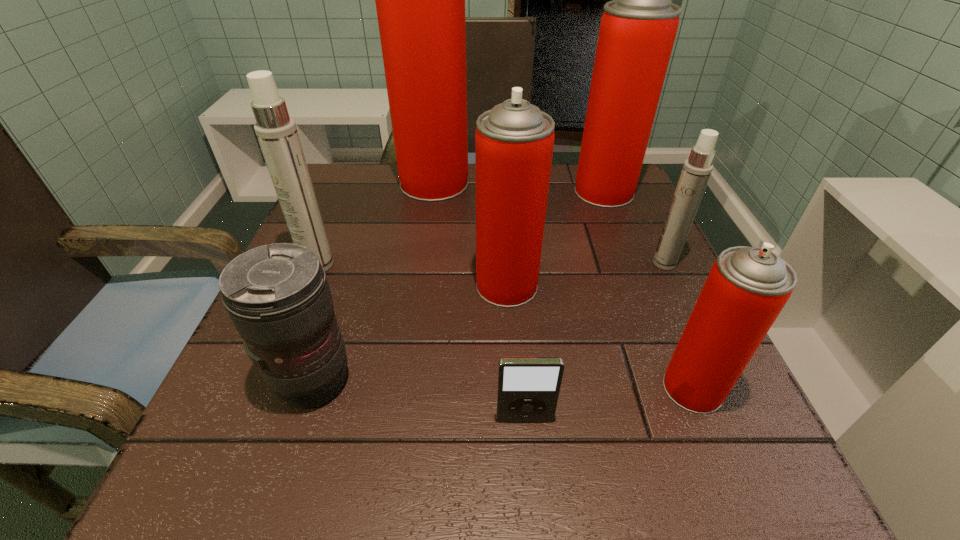
In the image, there is a desktop. Where is `free space at the far right corner`? The height and width of the screenshot is (540, 960). free space at the far right corner is located at coordinates (577, 175).

What are the coordinates of `vacant space in between the second nearest red aerosol can and the nearest red aerosol can` in the screenshot? It's located at (600, 337).

Where is `unoccupied position between the second red aerosol can from left to right and the biggest red aerosol can`? unoccupied position between the second red aerosol can from left to right and the biggest red aerosol can is located at coordinates (470, 234).

You are a GUI agent. You are given a task and a screenshot of the screen. Output one action in this format:
    pyautogui.click(x=<x>, y=<y>)
    Task: Click on the vacant area that lies between the second shortest object and the tallest aerosol can
    The width and height of the screenshot is (960, 540).
    Given the screenshot: What is the action you would take?
    pyautogui.click(x=374, y=282)

Locate an element on the screen. free space between the second nearest red aerosol can and the shortest object is located at coordinates pyautogui.click(x=516, y=353).

You are a GUI agent. You are given a task and a screenshot of the screen. Output one action in this format:
    pyautogui.click(x=<x>, y=<y>)
    Task: Click on the blank region between the nearest red aerosol can and the second tallest object
    
    Given the screenshot: What is the action you would take?
    pyautogui.click(x=648, y=290)

The height and width of the screenshot is (540, 960). I want to click on unoccupied position between the third red aerosol can from right to left and the smallest red aerosol can, so click(600, 337).

This screenshot has height=540, width=960. Find the location of `free space between the smallest red aerosol can and the smaller white aerosol can`. free space between the smallest red aerosol can and the smaller white aerosol can is located at coordinates (679, 326).

You are a GUI agent. You are given a task and a screenshot of the screen. Output one action in this format:
    pyautogui.click(x=<x>, y=<y>)
    Task: Click on the blank region between the shortest object and the smaller white aerosol can
    Image resolution: width=960 pixels, height=540 pixels.
    Given the screenshot: What is the action you would take?
    pyautogui.click(x=594, y=341)

Locate an element on the screen. This screenshot has width=960, height=540. the fifth closest object to the shortest object is located at coordinates (277, 133).